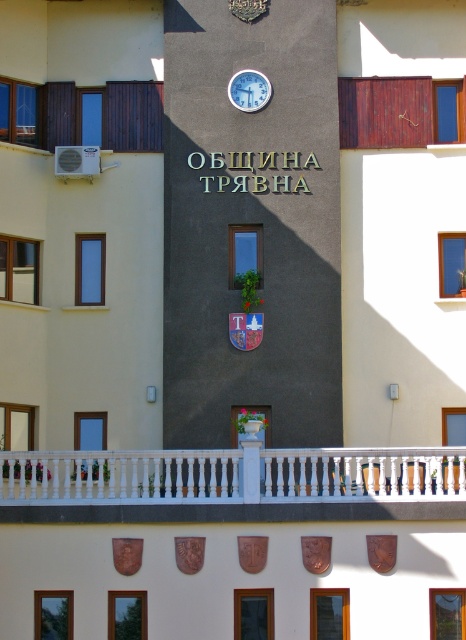
Question: Does white wooden railing at center appear on the right side of white plastic clock at upper center?

Choices:
 (A) yes
 (B) no

Answer: (B)

Question: Among these points, which one is nearest to the camera?

Choices:
 (A) click(x=360, y=460)
 (B) click(x=253, y=106)

Answer: (A)

Question: Among these points, which one is nearest to the camera?

Choices:
 (A) (244, 81)
 (B) (336, 476)

Answer: (B)

Question: Is white wooden railing at center to the left of white plastic clock at upper center from the viewer's perspective?

Choices:
 (A) yes
 (B) no

Answer: (A)

Question: Observing the image, what is the correct spatial positioning of white wooden railing at center in reference to white plastic clock at upper center?

Choices:
 (A) left
 (B) right

Answer: (A)